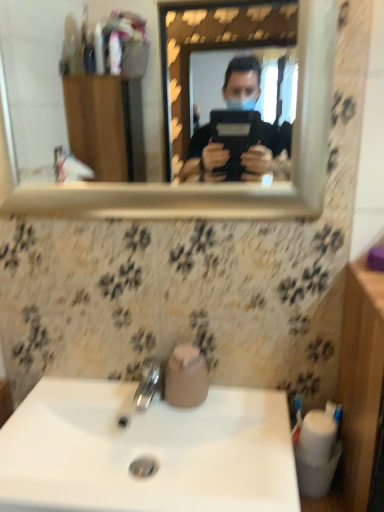
Where is `empty space that is to the right of pink matte toilet paper at sink`? empty space that is to the right of pink matte toilet paper at sink is located at coordinates (245, 408).